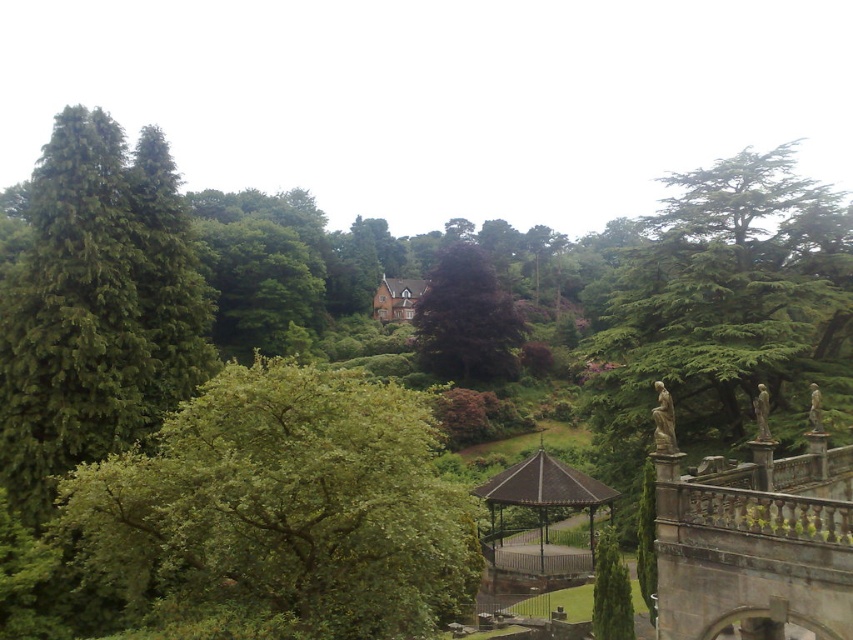
You are a landscape architect designing a new garden path between the green leafy tree at center and the dark purple leafy tree at center. The path must be straight and 2 meters wide. Can you estimate the minimum length of the path required to connect both trees?

The green leafy tree at center is 71.75 meters away from the dark purple leafy tree at center. Therefore, the minimum length of the path required to connect both trees would be approximately 71.75 meters.

You are standing at the center of the image and want to walk towards the green leafy tree at center. Which direction should you head?

Since the green leafy tree at center is located at point (282, 508), you should head towards the direction of that coordinate to reach it.